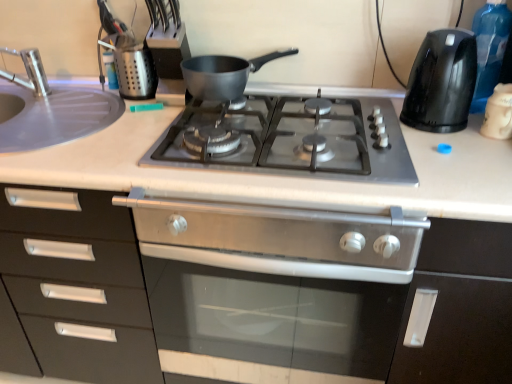
The height and width of the screenshot is (384, 512). I want to click on vacant space situated on the left part of white glossy coffee cup at upper right, which is counted as the 1th kitchen appliance, starting from the right, so click(x=436, y=140).